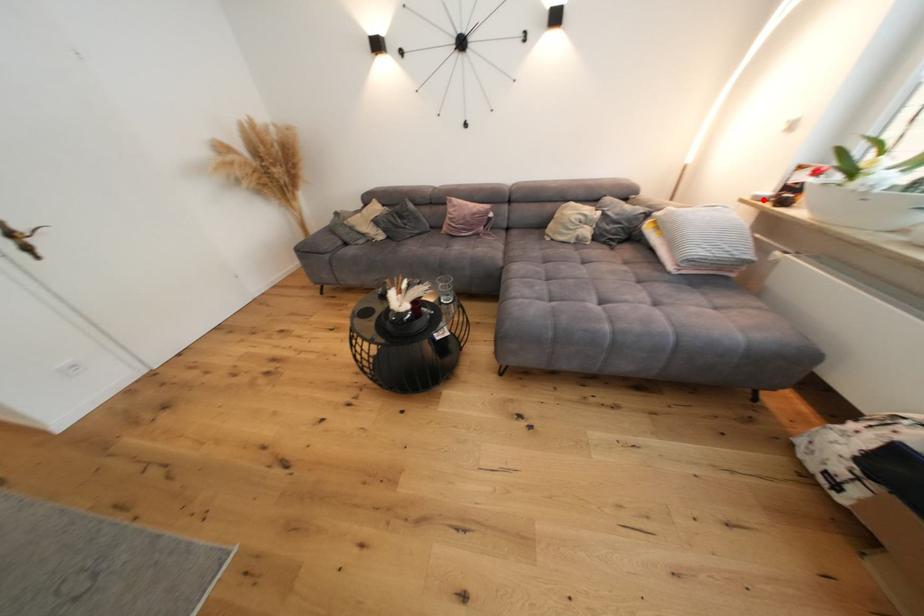
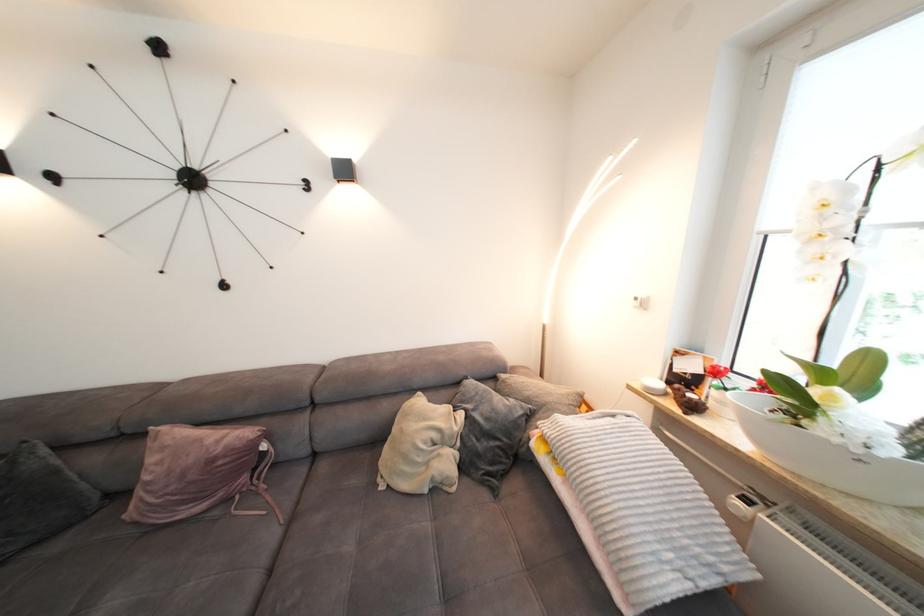
Where in the second image is the point corresponding to the highlighted location from the first image?

(657, 391)